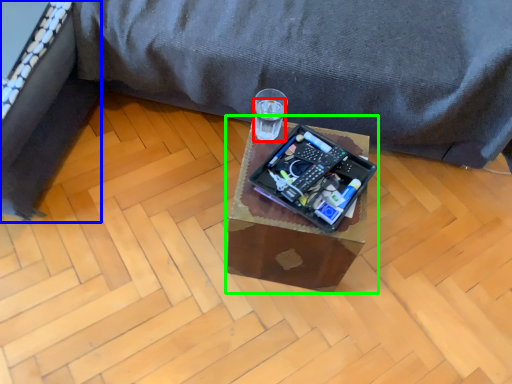
Question: Which is farther away from beverage (highlighted by a red box)? bed frame (highlighted by a blue box) or table (highlighted by a green box)?

Choices:
 (A) bed frame
 (B) table

Answer: (A)